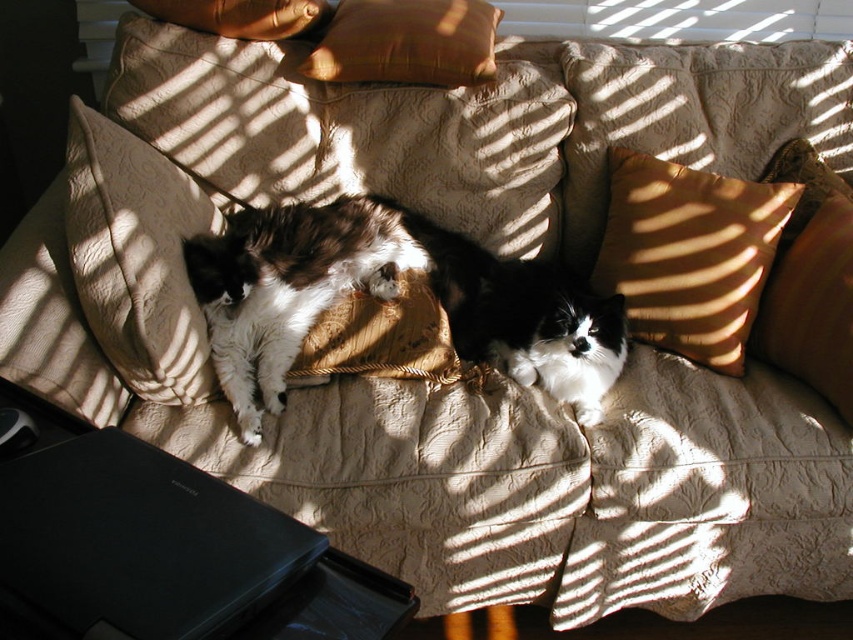
You are organizing a space for a small pet. You have a black plastic laptop at lower left and a matte orange pillow at right. Which object is shorter?

The black plastic laptop at lower left is shorter than the matte orange pillow at right.